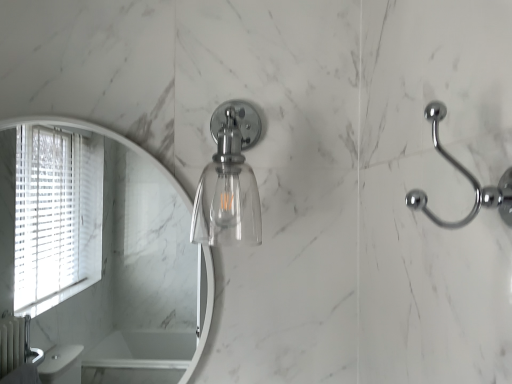
In the scene shown: In order to face clear glass light fixture at center, should I rotate leftwards or rightwards?

You should rotate left by 2.823 degrees.

Describe the element at coordinates (229, 181) in the screenshot. I see `clear glass light fixture at center` at that location.

Looking at this image, measure the distance between clear glass light fixture at center and camera.

clear glass light fixture at center is 31.10 inches from camera.

The image size is (512, 384). Find the location of `clear glass light fixture at center`. clear glass light fixture at center is located at coordinates (229, 181).

What is the approximate height of polished chrome hook at right?

The height of polished chrome hook at right is 6.51 inches.

At what (x,y) coordinates should I click in order to perform the action: click on polished chrome hook at right. Please return your answer as a coordinate pair (x, y). This screenshot has width=512, height=384. Looking at the image, I should click on (464, 175).

Describe the element at coordinates (464, 175) in the screenshot. Image resolution: width=512 pixels, height=384 pixels. I see `polished chrome hook at right` at that location.

Where is `clear glass light fixture at center`? clear glass light fixture at center is located at coordinates (229, 181).

Is clear glass light fixture at center at the left side of polished chrome hook at right?

Indeed, clear glass light fixture at center is positioned on the left side of polished chrome hook at right.

Which object is more forward, clear glass light fixture at center or polished chrome hook at right?

polished chrome hook at right is closer to the camera.

Which point is more distant from viewer, (201, 179) or (495, 192)?

The point (201, 179) is farther.

From the image's perspective, is clear glass light fixture at center above or below polished chrome hook at right?

clear glass light fixture at center is above polished chrome hook at right.

From a real-world perspective, between clear glass light fixture at center and polished chrome hook at right, who is vertically higher?

clear glass light fixture at center is physically above.

Which of these two, clear glass light fixture at center or polished chrome hook at right, is thinner?

polished chrome hook at right is thinner.

Who is taller, clear glass light fixture at center or polished chrome hook at right?

With more height is clear glass light fixture at center.

Is clear glass light fixture at center smaller than polished chrome hook at right?

No.

Would you say clear glass light fixture at center is outside polished chrome hook at right?

Indeed, clear glass light fixture at center is completely outside polished chrome hook at right.

Is the surface of clear glass light fixture at center in direct contact with polished chrome hook at right?

No, clear glass light fixture at center is not in contact with polished chrome hook at right.

Is clear glass light fixture at center positioned with its back to polished chrome hook at right?

No, clear glass light fixture at center is not facing away from polished chrome hook at right.

The height and width of the screenshot is (384, 512). What are the coordinates of `soap dispenser above the polished chrome hook at right (from a real-world perspective)` in the screenshot? It's located at (229, 181).

Is polished chrome hook at right to the left of clear glass light fixture at center from the viewer's perspective?

No.

From the picture: Relative to clear glass light fixture at center, is polished chrome hook at right in front or behind?

Clearly, polished chrome hook at right is in front of clear glass light fixture at center.

Considering the positions of points (437, 101) and (211, 224), is point (437, 101) farther from camera compared to point (211, 224)?

No.

From the image's perspective, which one is positioned higher, polished chrome hook at right or clear glass light fixture at center?

clear glass light fixture at center.

From a real-world perspective, is polished chrome hook at right on clear glass light fixture at center?

Incorrect, from a real-world perspective, polished chrome hook at right is lower than clear glass light fixture at center.

Does polished chrome hook at right have a lesser width compared to clear glass light fixture at center?

Correct, the width of polished chrome hook at right is less than that of clear glass light fixture at center.

Considering the relative sizes of polished chrome hook at right and clear glass light fixture at center in the image provided, is polished chrome hook at right shorter than clear glass light fixture at center?

Yes, polished chrome hook at right is shorter than clear glass light fixture at center.

Which of these two, polished chrome hook at right or clear glass light fixture at center, is smaller?

With smaller size is polished chrome hook at right.

Can clear glass light fixture at center be found inside polished chrome hook at right?

No, clear glass light fixture at center is not a part of polished chrome hook at right.

Is polished chrome hook at right not near clear glass light fixture at center?

No, polished chrome hook at right is not far away from clear glass light fixture at center.

Based on the photo, is polished chrome hook at right facing away from clear glass light fixture at center?

polished chrome hook at right is not turned away from clear glass light fixture at center.

Can you tell me how much polished chrome hook at right and clear glass light fixture at center differ in facing direction?

90.6 degrees separate the facing orientations of polished chrome hook at right and clear glass light fixture at center.

Where is `soap dispenser that appears behind the polished chrome hook at right`? The width and height of the screenshot is (512, 384). soap dispenser that appears behind the polished chrome hook at right is located at coordinates (229, 181).

At what (x,y) coordinates should I click in order to perform the action: click on door handle in front of the clear glass light fixture at center. Please return your answer as a coordinate pair (x, y). The image size is (512, 384). Looking at the image, I should click on (464, 175).

You are a GUI agent. You are given a task and a screenshot of the screen. Output one action in this format:
    pyautogui.click(x=<x>, y=<y>)
    Task: Click on the soap dispenser behind the polished chrome hook at right
    This screenshot has width=512, height=384.
    Given the screenshot: What is the action you would take?
    pyautogui.click(x=229, y=181)